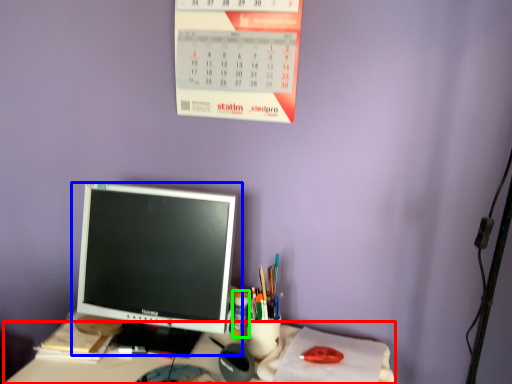
Question: Considering the real-world distances, which object is closest to desk (highlighted by a red box)? computer monitor (highlighted by a blue box) or stationery (highlighted by a green box).

Choices:
 (A) computer monitor
 (B) stationery

Answer: (B)